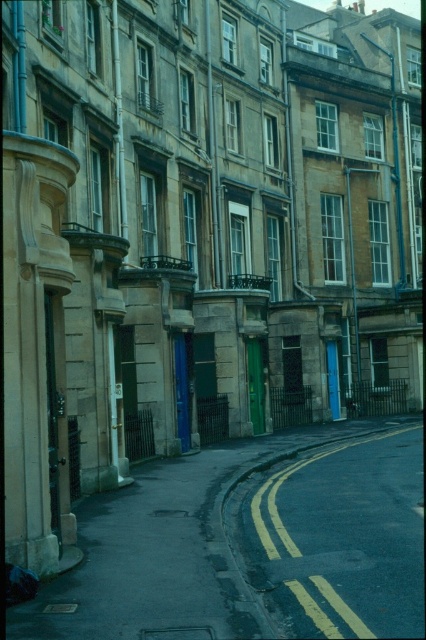
You are a delivery driver navigating a narrow street with a truck that is 2 meters wide. You need to pass through the space between the smooth asphalt road at center and the yellow asphalt at center. Can your truck fit through the space between them?

The smooth asphalt road at center is positioned on the left side of yellow asphalt at center, but the exact width of the space between them isn not provided in the description. Therefore, it is uncertain if the truck can fit through the space.

You are standing at the point labeled point (252, 545) in the image. What type of surface are you currently standing on?

You are standing on the smooth asphalt road at center, as the point (252, 545) corresponds to that surface according to the description.

You are standing on the sidewalk and looking at the street. Which of the two objects, the smooth asphalt road at center or the yellow asphalt at center, is nearer to you?

The smooth asphalt road at center is closer to the viewer than the yellow asphalt at center.